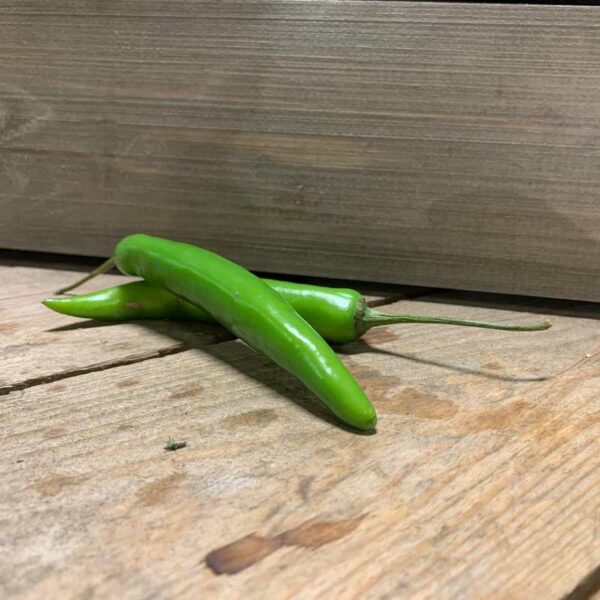
Where is `large crack under wall`? This screenshot has height=600, width=600. large crack under wall is located at coordinates (574, 302), (65, 254).